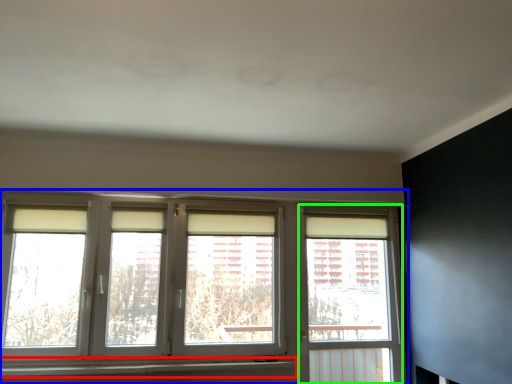
Question: Which object is the closest to the window sill (highlighted by a red box)? Choose among these: window (highlighted by a blue box) or window frame (highlighted by a green box).

Choices:
 (A) window
 (B) window frame

Answer: (A)